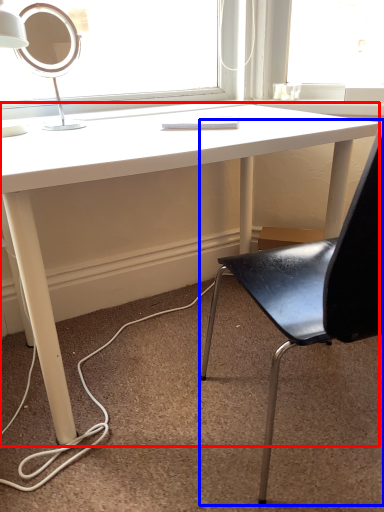
Question: Which object is closer to the camera taking this photo, desk (highlighted by a red box) or chair (highlighted by a blue box)?

Choices:
 (A) desk
 (B) chair

Answer: (B)